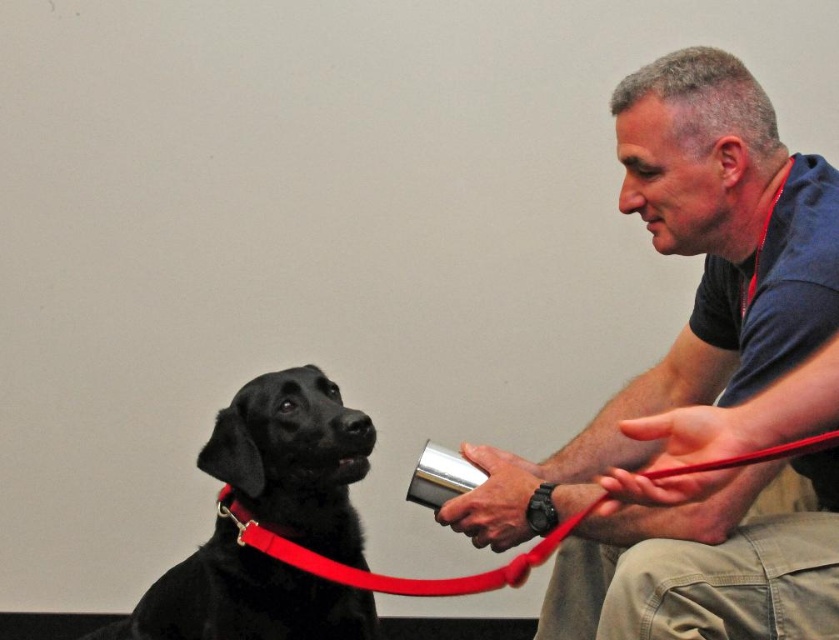
You are a dog trainer observing the scene. You need to determine if there is enough space between the two dogs to safely walk between them. The minimum safe distance required is 30 centimeters. Can you walk between the matte black dog at left and the black smooth dog at left?

The matte black dog at left and the black smooth dog at left are 34.31 centimeters apart from each other, which is greater than the minimum safe distance of 30 centimeters. Therefore, you can safely walk between them.

You are a dog trainer observing the scene. The black smooth dog at left is holding something in its mouth. Can you determine if the dog can comfortably open its mouth wide enough to swallow the red leather leash at lower left whole?

The black smooth dog at left has a width less than the red leather leash at lower left, so it cannot comfortably open its mouth wide enough to swallow the red leather leash at lower left whole.

You are a photographer trying to capture the interaction between the matte black dog at left and the red leather leash at lower left. Since the leash is smaller, where should you position your camera to ensure both objects are clearly visible in the frame?

The matte black dog at left is larger than the red leather leash at lower left. To include both in the frame, position the camera closer to the leash or zoom out to capture the dog and the smaller leash together.